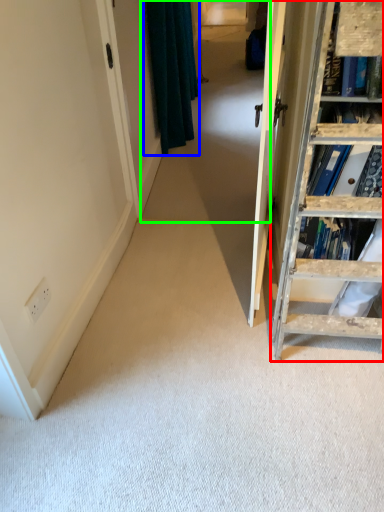
Question: Considering the real-world distances, which object is closest to ladder (highlighted by a red box)? curtain (highlighted by a blue box) or passage (highlighted by a green box).

Choices:
 (A) curtain
 (B) passage

Answer: (B)